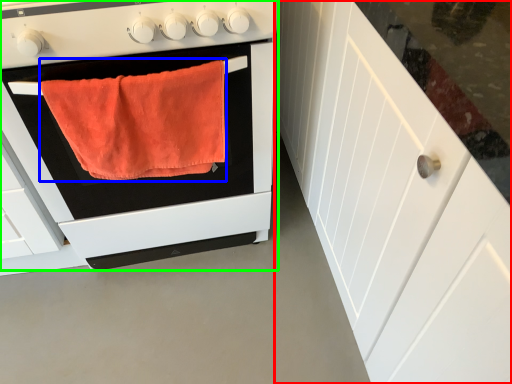
Question: Which object is the closest to the cabinetry (highlighted by a red box)? Choose among these: bath towel (highlighted by a blue box) or oven (highlighted by a green box).

Choices:
 (A) bath towel
 (B) oven

Answer: (B)